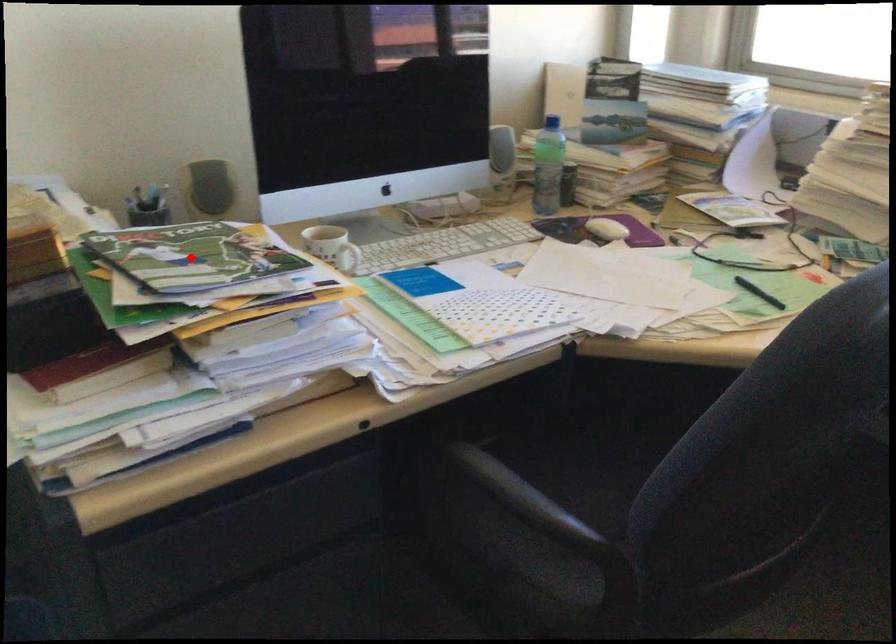
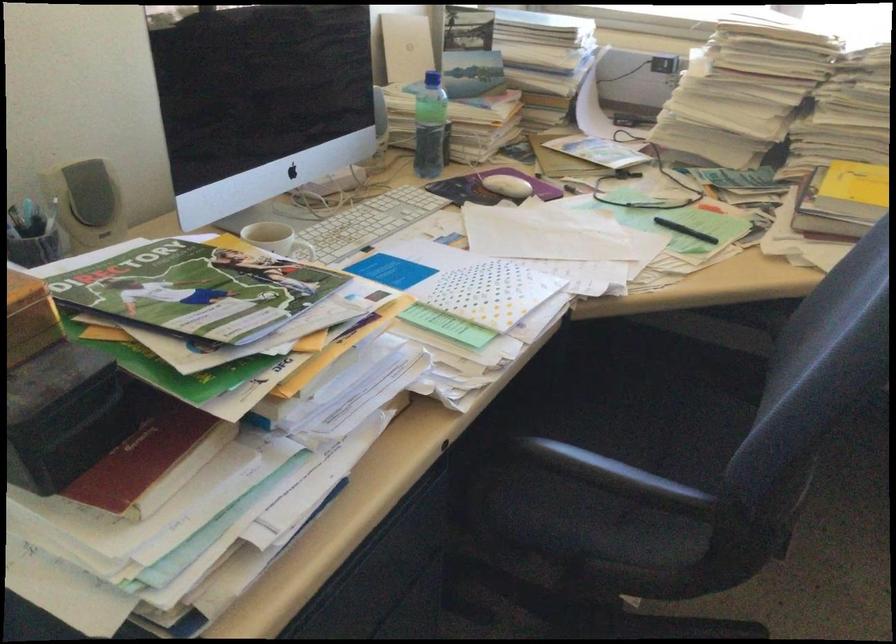
In the second image, find the point that corresponds to the highlighted location in the first image.

(195, 290)